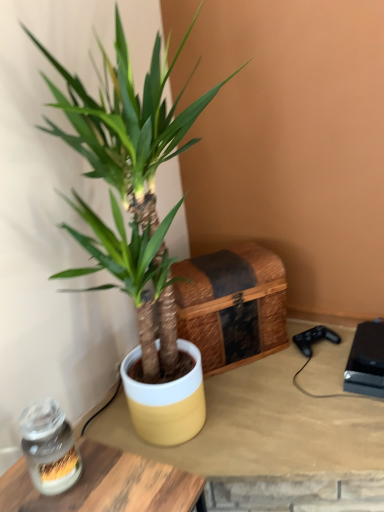
Question: In terms of height, does yellow matte pot at center, which is the 1th table in back-to-front order, look taller or shorter compared to clear glass jar at lower left?

Choices:
 (A) short
 (B) tall

Answer: (A)

Question: In terms of size, does yellow matte pot at center, which is the 1th table in back-to-front order, appear bigger or smaller than clear glass jar at lower left?

Choices:
 (A) small
 (B) big

Answer: (B)

Question: Which is farther from the clear glass jar at lower left?

Choices:
 (A) black plastic game console at lower right
 (B) yellow matte pot at center, which is the 1th table in back-to-front order
 (C) green matte plant at center
 (D) wooden table at lower left, the second table when ordered from back to front
 (E) woven wood chest at center

Answer: (A)

Question: Which object is the closest to the wooden table at lower left, the first table viewed from the front?

Choices:
 (A) yellow matte pot at center, which is counted as the 2th table, starting from the front
 (B) black plastic game console at lower right
 (C) woven wood chest at center
 (D) clear glass jar at lower left
 (E) green matte plant at center

Answer: (D)